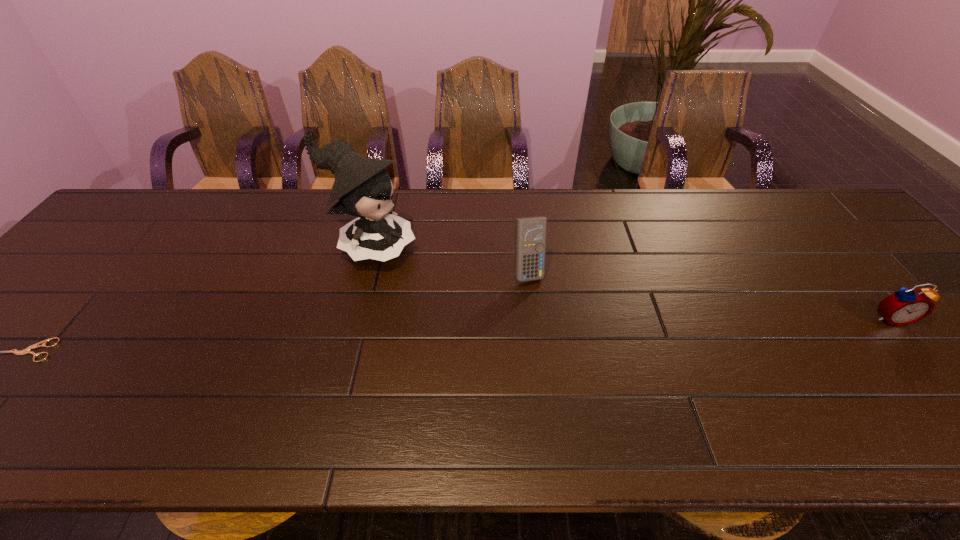
Locate an element on the screen. This screenshot has height=540, width=960. the second nearest object is located at coordinates (905, 306).

I want to click on alarm clock, so click(905, 306).

The width and height of the screenshot is (960, 540). Identify the location of the second object from left to right. (364, 188).

You are a GUI agent. You are given a task and a screenshot of the screen. Output one action in this format:
    pyautogui.click(x=<x>, y=<y>)
    Task: Click on the doll
    
    Given the screenshot: What is the action you would take?
    pyautogui.click(x=364, y=188)

The image size is (960, 540). What are the coordinates of `calculator` in the screenshot? It's located at (530, 233).

I want to click on the second object from right to left, so click(x=530, y=233).

The width and height of the screenshot is (960, 540). What are the coordinates of `vacant position located on the front-facing side of the rightmost object` in the screenshot? It's located at (928, 363).

This screenshot has width=960, height=540. Find the location of `vacant region located at the face of the tallest object`. vacant region located at the face of the tallest object is located at coordinates (525, 316).

Where is `vacant space situated at the face of the tallest object`? This screenshot has width=960, height=540. vacant space situated at the face of the tallest object is located at coordinates (486, 299).

You are a GUI agent. You are given a task and a screenshot of the screen. Output one action in this format:
    pyautogui.click(x=<x>, y=<y>)
    Task: Click on the vacant position located 0.400m at the face of the tallest object
    Image resolution: width=960 pixels, height=540 pixels.
    Given the screenshot: What is the action you would take?
    pyautogui.click(x=540, y=323)